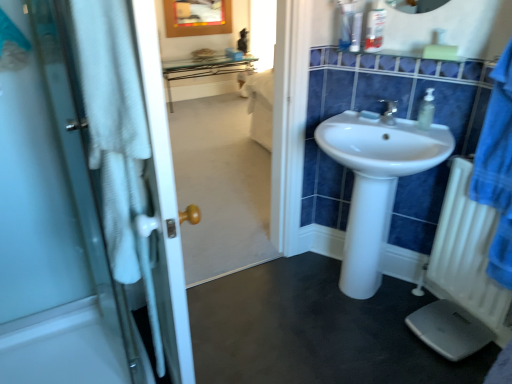
Find the location of a particular element. free point above black rubber mat at lower center (from a real-world perspective) is located at coordinates coord(312,320).